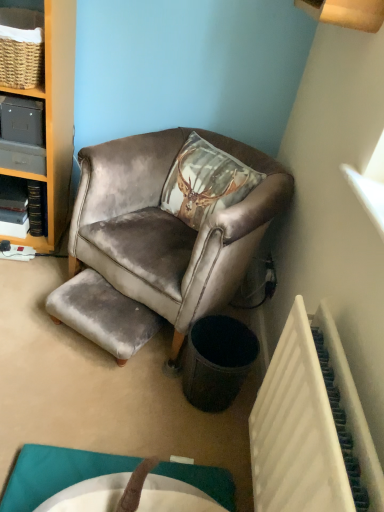
Locate an element on the screen. The width and height of the screenshot is (384, 512). free space that is to the left of black textured trash bin at lower right is located at coordinates (152, 388).